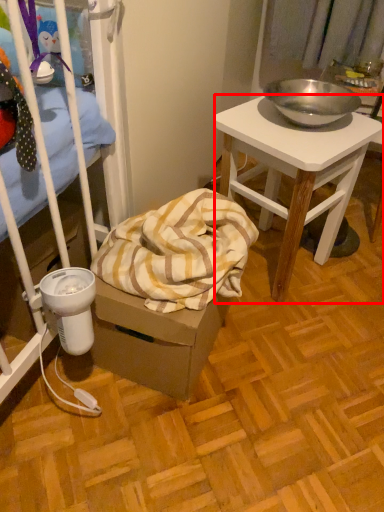
Question: Where is desk (annotated by the red box) located in relation to blanket in the image?

Choices:
 (A) right
 (B) left

Answer: (A)